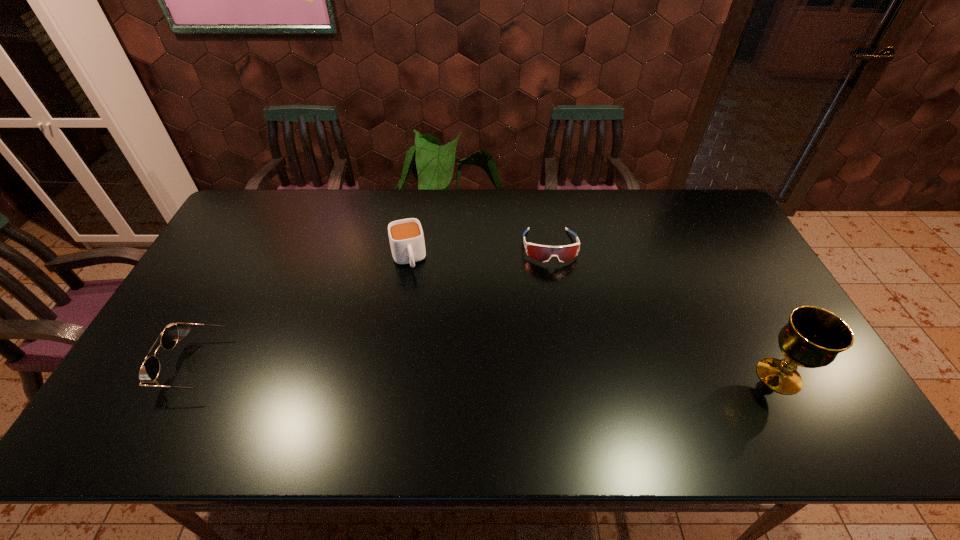
Where is `sunglasses`? sunglasses is located at coordinates (149, 371).

Identify the location of chalice. The height and width of the screenshot is (540, 960). (813, 337).

Identify the location of the rightmost object. The height and width of the screenshot is (540, 960). (813, 337).

You are a GUI agent. You are given a task and a screenshot of the screen. Output one action in this format:
    pyautogui.click(x=<x>, y=<y>)
    Task: Click on the cup
    
    Given the screenshot: What is the action you would take?
    pyautogui.click(x=406, y=237)

I want to click on the shortest object, so click(x=542, y=253).

Identify the location of the second object from right to left. (542, 253).

Locate an element on the screen. vacant space located 0.070m on the front lenses of the sunglasses is located at coordinates (144, 366).

I want to click on vacant region located on the front lenses of the sunglasses, so click(152, 366).

Find the location of a particular element. The width and height of the screenshot is (960, 540). free space located 0.230m on the back of the tallest object is located at coordinates (732, 289).

Where is `free spot located 0.250m on the side with the handle of the cup`? free spot located 0.250m on the side with the handle of the cup is located at coordinates (426, 341).